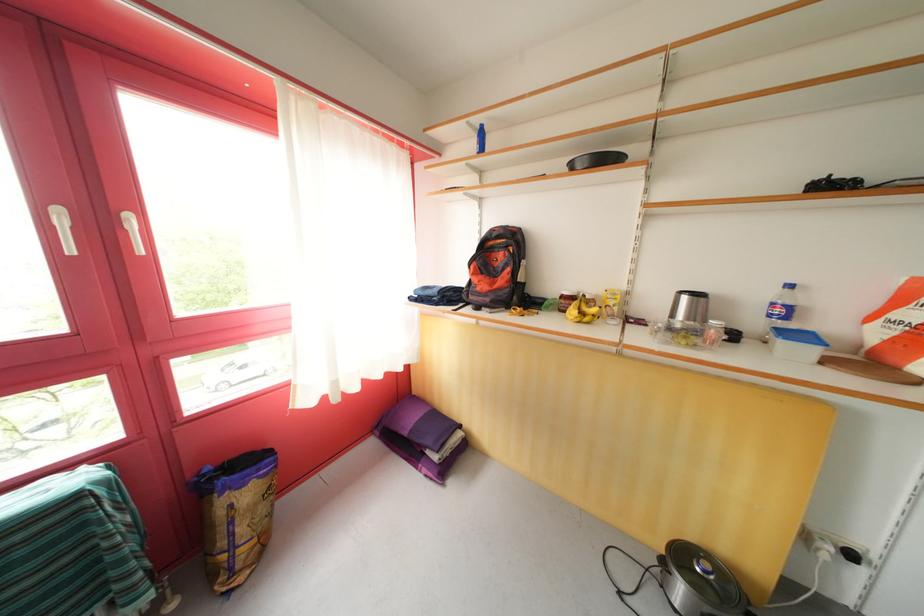
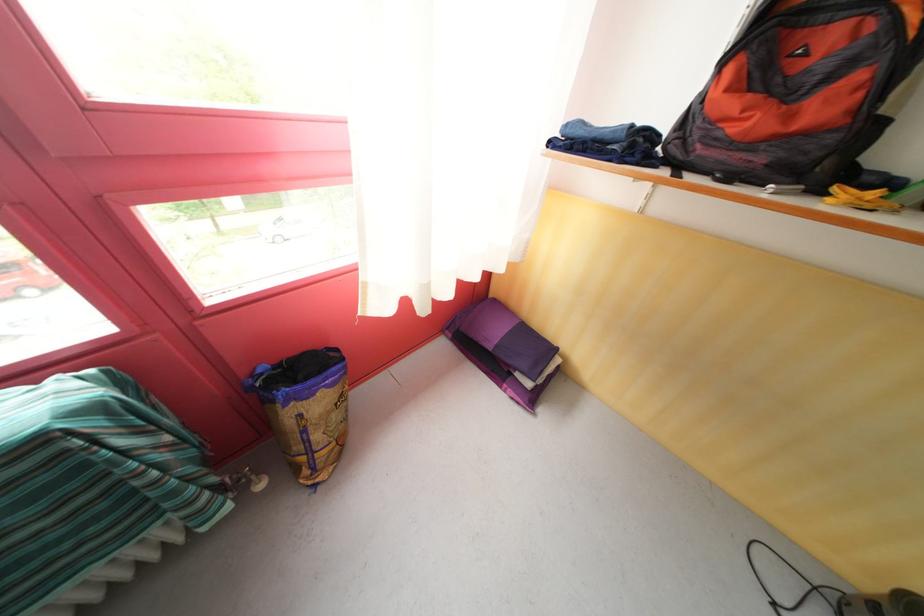
Find the pixel in the second image that matches the point at 487,300 in the first image.

(736, 151)